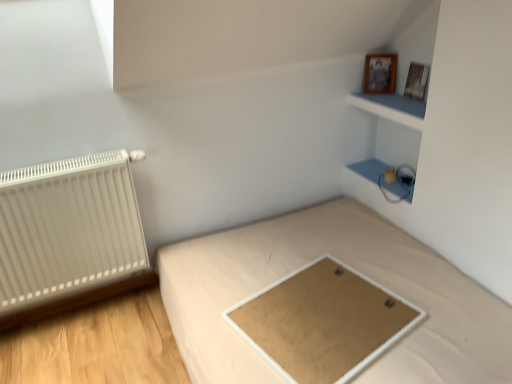
I want to click on free spot behind matte brown board at center, so click(x=314, y=247).